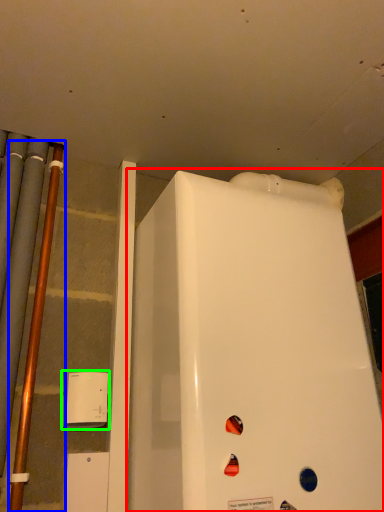
Question: Considering the real-world distances, which object is farthest from refrigerator (highlighted by a red box)? pipe (highlighted by a blue box) or appliance (highlighted by a green box)?

Choices:
 (A) pipe
 (B) appliance

Answer: (A)